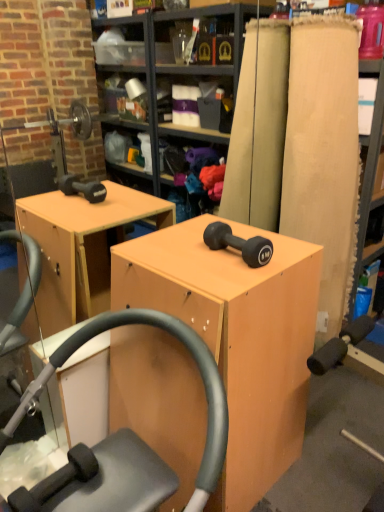
Question: Does matte wood cabinet at center have a larger size compared to matte wood plank at right?

Choices:
 (A) yes
 (B) no

Answer: (A)

Question: Is there a large distance between matte wood cabinet at center and matte wood plank at right?

Choices:
 (A) yes
 (B) no

Answer: (B)

Question: Considering the relative sizes of matte wood cabinet at center and matte wood plank at right in the image provided, is matte wood cabinet at center taller than matte wood plank at right?

Choices:
 (A) yes
 (B) no

Answer: (B)

Question: Is matte wood plank at right located within matte wood cabinet at center?

Choices:
 (A) yes
 (B) no

Answer: (B)

Question: Considering the relative sizes of matte wood cabinet at center and matte wood plank at right in the image provided, is matte wood cabinet at center wider than matte wood plank at right?

Choices:
 (A) yes
 (B) no

Answer: (A)

Question: Would you say matte wood cabinet at center is to the left or to the right of matte wood plank at right in the picture?

Choices:
 (A) right
 (B) left

Answer: (B)

Question: In terms of size, does matte wood cabinet at center appear bigger or smaller than matte wood plank at right?

Choices:
 (A) big
 (B) small

Answer: (A)

Question: Considering the positions of matte wood cabinet at center and matte wood plank at right in the image, is matte wood cabinet at center wider or thinner than matte wood plank at right?

Choices:
 (A) thin
 (B) wide

Answer: (B)

Question: Do you think matte wood cabinet at center is within matte wood plank at right, or outside of it?

Choices:
 (A) inside
 (B) outside

Answer: (B)

Question: In the image, is matte black dumbbell at center on the left side or the right side of matte wood cabinet at center?

Choices:
 (A) right
 (B) left

Answer: (A)

Question: Relative to matte wood cabinet at center, is matte black dumbbell at center in front or behind?

Choices:
 (A) behind
 (B) front

Answer: (A)

Question: Considering the positions of matte black dumbbell at center and matte wood cabinet at center in the image, is matte black dumbbell at center wider or thinner than matte wood cabinet at center?

Choices:
 (A) thin
 (B) wide

Answer: (A)

Question: From the image's perspective, is matte black dumbbell at center above or below matte wood cabinet at center?

Choices:
 (A) above
 (B) below

Answer: (A)

Question: From their relative heights in the image, would you say matte wood cabinet at center is taller or shorter than matte black dumbbell at center?

Choices:
 (A) tall
 (B) short

Answer: (A)

Question: Considering the positions of point (314, 296) and point (264, 249), is point (314, 296) closer or farther from the camera than point (264, 249)?

Choices:
 (A) closer
 (B) farther

Answer: (B)